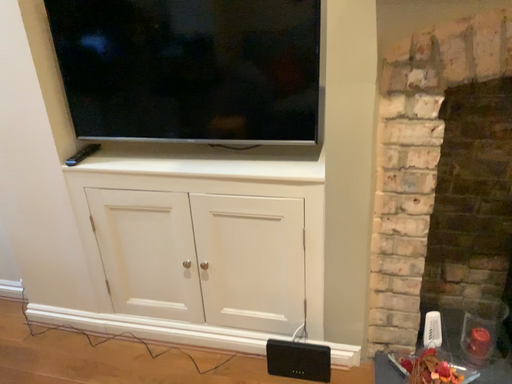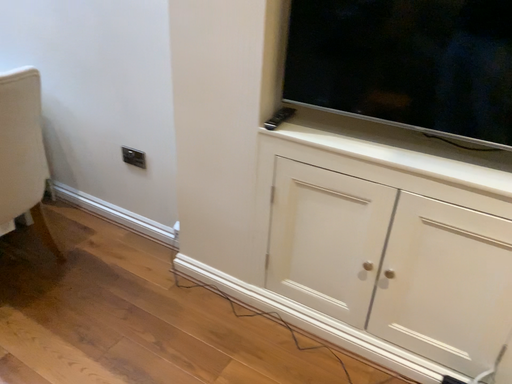
Question: How did the camera likely rotate when shooting the video?

Choices:
 (A) rotated left
 (B) rotated right

Answer: (A)